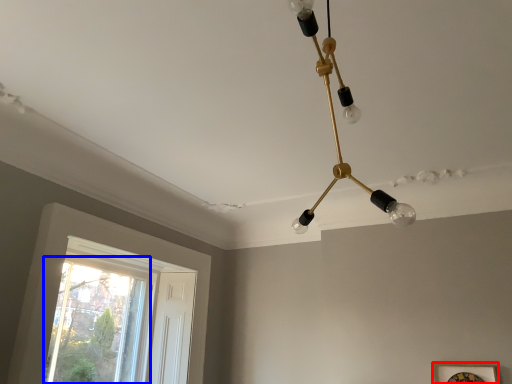
Question: Which object appears farthest to the camera in this image, picture frame (highlighted by a red box) or window (highlighted by a blue box)?

Choices:
 (A) picture frame
 (B) window

Answer: (B)